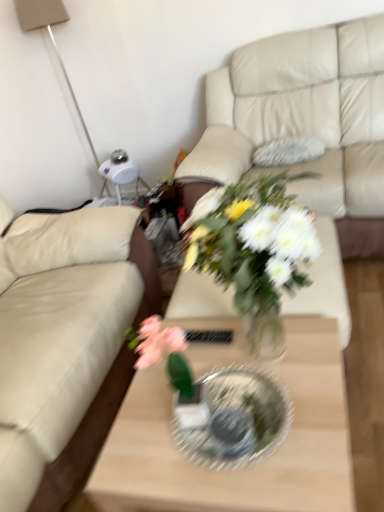
Question: Is clear glass coffee table at center inside the boundaries of beige leather couch at left, acting as the second studio couch starting from the right, or outside?

Choices:
 (A) inside
 (B) outside

Answer: (B)

Question: Considering the positions of clear glass coffee table at center and beige leather couch at left, the first studio couch from the left, in the image, is clear glass coffee table at center wider or thinner than beige leather couch at left, the first studio couch from the left,?

Choices:
 (A) wide
 (B) thin

Answer: (B)

Question: Estimate the real-world distances between objects in this image. Which object is closer to the clear glass plate at center?

Choices:
 (A) beige leather couch at upper center, which is the second studio couch in left-to-right order
 (B) translucent glass vase at center
 (C) clear glass coffee table at center
 (D) matte white lamp at upper left
 (E) beige leather couch at left, the first studio couch from the left

Answer: (C)

Question: Which is farther from the beige leather couch at left, the first studio couch from the left?

Choices:
 (A) translucent glass vase at center
 (B) matte white lamp at upper left
 (C) clear glass plate at center
 (D) beige leather couch at upper center, which is counted as the 1th studio couch, starting from the right
 (E) clear glass coffee table at center

Answer: (B)